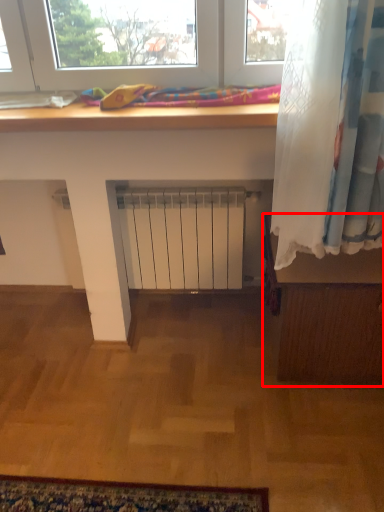
Question: Where is furniture (annotated by the red box) located in relation to bedding in the image?

Choices:
 (A) right
 (B) left

Answer: (A)